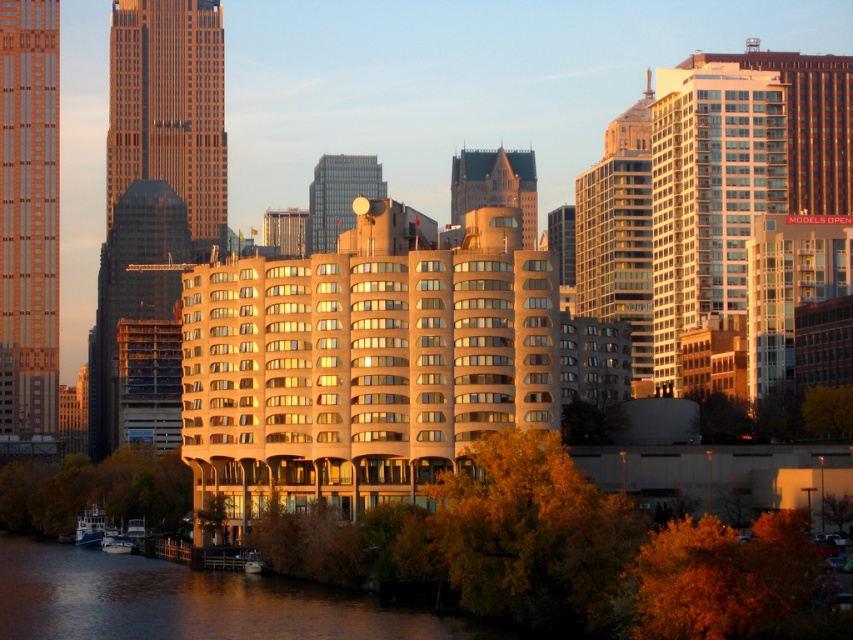
You are a photographer planning to capture the brown water at lower left and the metallic satellite dish at center in a single frame. Based on their sizes in the scene, which object will occupy more of the camera frame?

The brown water at lower left will occupy more of the camera frame because its width is larger than that of the metallic satellite dish at center.

You are an urban planner analyzing the city layout. You observe the matte glass skyscraper at left and the metallic satellite dish at center. Which object occupies more horizontal space in the scene?

The matte glass skyscraper at left occupies more horizontal space than the metallic satellite dish at center because its width surpasses the satellite dish.

You are standing at the waterfront in the image and want to take a photo of the matte glass skyscraper at left. The camera you are using has a maximum zoom range of 100 meters. Can you capture the entire building in your photo without moving closer?

The matte glass skyscraper at left is 284.56 meters from the viewer. Since the camera can only zoom up to 100 meters, you cannot capture the entire building in the photo without moving closer.